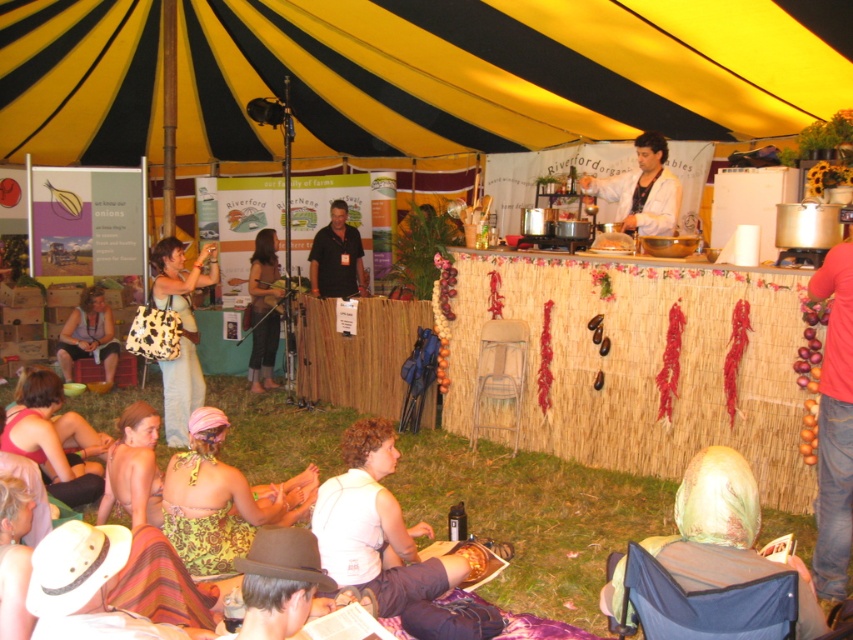
You are a photographer at the event and want to capture both the green fabric headscarf at lower right and the dark brown shirt at center in a single shot. Which direction should you move to frame both subjects properly?

Since the green fabric headscarf at lower right is to the right of the dark brown shirt at center, you should move to the left to frame both subjects properly.

You are a photographer at the event and want to capture both the white matte jacket at upper center and the green floral dress at lower left in the same frame. Which person is blocking your view of the other?

The green floral dress at lower left is behind the white matte jacket at upper center, so the white matte jacket at upper center is blocking the view of the green floral dress at lower left.

You are a photographer at the event and want to capture both the green fabric headscarf at lower right and the dark brown shirt at center in the same frame. Which object should you focus on first to ensure both are in the frame?

The green fabric headscarf at lower right is shorter than the dark brown shirt at center, so you should focus on the dark brown shirt at center first to ensure both are in the frame.